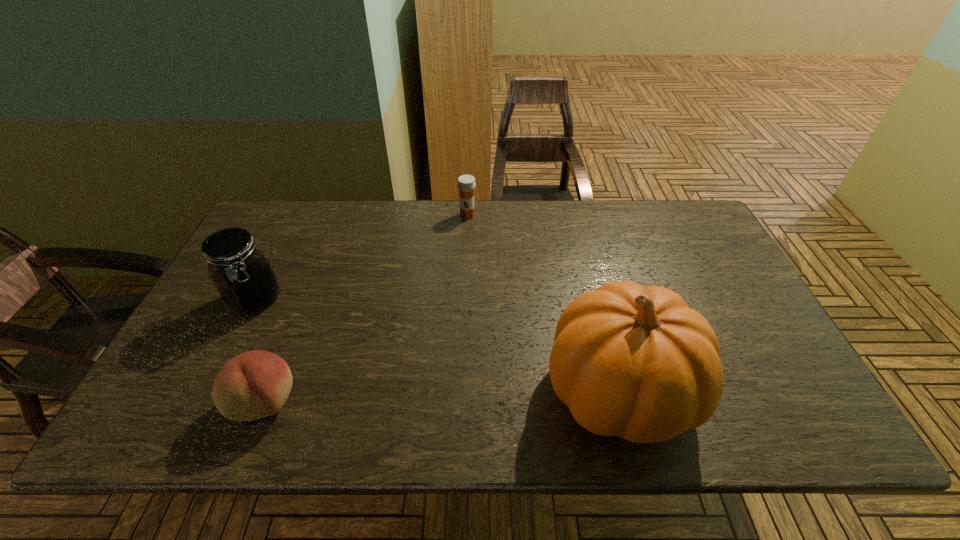
You are a GUI agent. You are given a task and a screenshot of the screen. Output one action in this format:
    pyautogui.click(x=<x>, y=<y>)
    Task: Click on the free location at the near edge of the desktop
    
    Given the screenshot: What is the action you would take?
    pyautogui.click(x=423, y=379)

At what (x,y) coordinates should I click in order to perform the action: click on vacant area at the right edge. Please return your answer as a coordinate pair (x, y). Image resolution: width=960 pixels, height=540 pixels. Looking at the image, I should click on (728, 288).

Identify the location of free region at the far left corner of the desktop. This screenshot has width=960, height=540. (305, 219).

What are the coordinates of `free space at the far right corner of the desktop` in the screenshot? It's located at (686, 210).

You are a GUI agent. You are given a task and a screenshot of the screen. Output one action in this format:
    pyautogui.click(x=<x>, y=<y>)
    Task: Click on the free space between the second object from right to left and the second farthest object
    The width and height of the screenshot is (960, 540).
    Given the screenshot: What is the action you would take?
    pyautogui.click(x=361, y=258)

At what (x,y) coordinates should I click in order to perform the action: click on empty location between the second tallest object and the pumpkin. Please return your answer as a coordinate pair (x, y). The width and height of the screenshot is (960, 540). Looking at the image, I should click on (437, 346).

Identify the location of unoccupied area between the peach and the farthest object. The height and width of the screenshot is (540, 960). (366, 308).

This screenshot has width=960, height=540. In order to click on unoccupied area between the second tallest object and the medicine in this screenshot , I will do `click(361, 258)`.

Where is `vacant space in between the medicine and the tallest object`? The width and height of the screenshot is (960, 540). vacant space in between the medicine and the tallest object is located at coordinates (542, 302).

Identify the location of vacant space that is in between the rightmost object and the peach. The height and width of the screenshot is (540, 960). (442, 396).